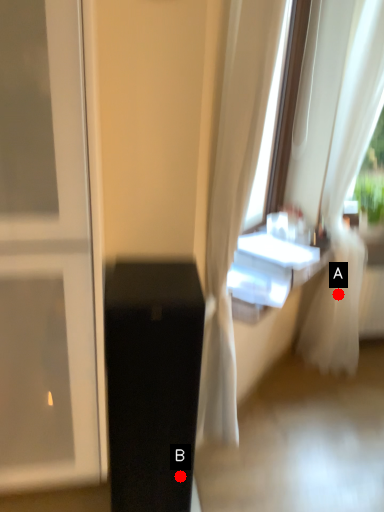
Question: Two points are circled on the image, labeled by A and B beside each circle. Which of the following is the farthest from the observer?

Choices:
 (A) A is further
 (B) B is further

Answer: (A)